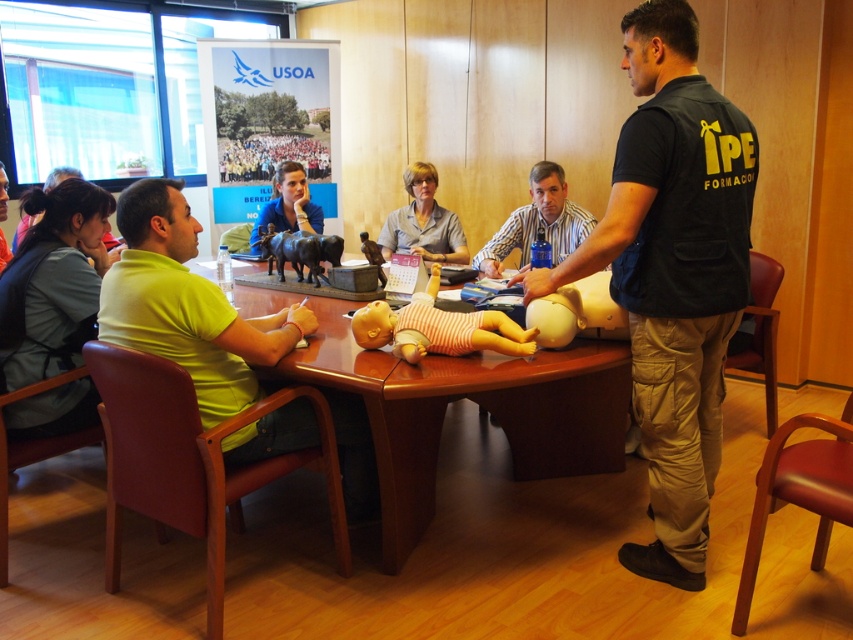
Based on the photo, you are a participant in the first aid training session and want to reach both the matte blue shirt at center and the metallic brown cow at center on the table. Which object should you reach for first to grab the closest one?

The matte blue shirt at center is closer to you than the metallic brown cow at center, so you should reach for the matte blue shirt at center first.

You are a participant in the first aid training session. You need to retrieve an item from the table but are currently standing near the black vest at center. The item you need is located near the matte blue shirt at upper center. Can you reach it without moving more than 6 feet from your current position?

The black vest at center is 6.61 feet away from the matte blue shirt at upper center. Since 6.61 feet is slightly more than 6 feet, you cannot reach the item without moving beyond the 6 feet limit.

You are attending a first aid training session and notice two participants wearing different colored clothing. The black vest at center and the matte blue shirt at upper center are both visible. Which participant is wearing a larger piece of clothing?

The black vest at center is bigger than the matte blue shirt at upper center, so the participant wearing the black vest at center has the larger clothing.